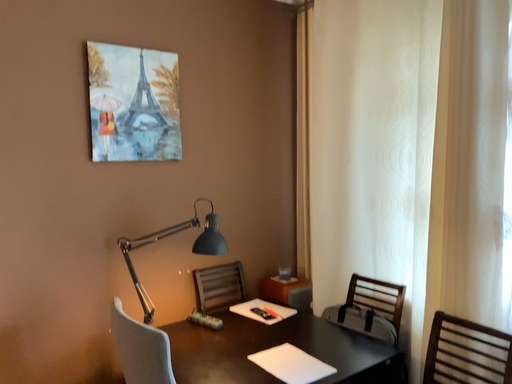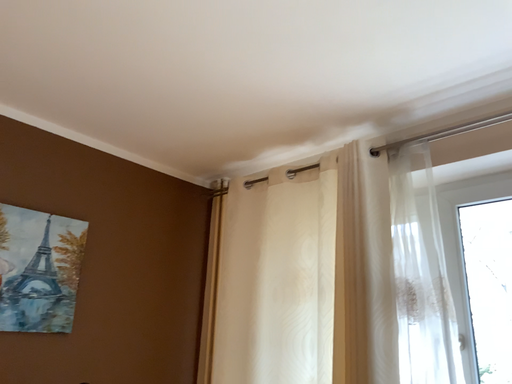
Question: How did the camera likely rotate when shooting the video?

Choices:
 (A) rotated left
 (B) rotated right

Answer: (B)